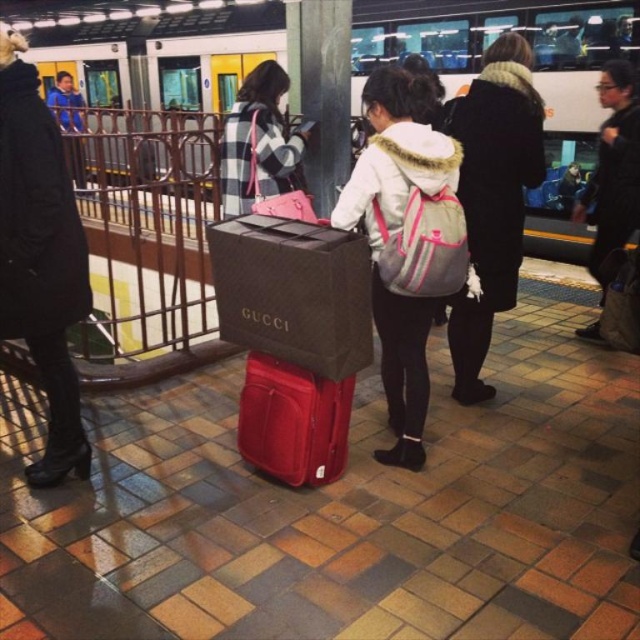
Question: Which object is the closest to the black leather jacket at upper right?

Choices:
 (A) smooth gray pillar at center
 (B) black wool coat at center
 (C) black leather coat at left
 (D) metallic silver train at center

Answer: (B)

Question: Is metallic silver train at center positioned at the back of black wool coat at center?

Choices:
 (A) no
 (B) yes

Answer: (B)

Question: Observing the image, what is the correct spatial positioning of matte black gucci bag at center in reference to white fleece jacket at center?

Choices:
 (A) left
 (B) right

Answer: (A)

Question: Is matte black gucci bag at center to the right of black wool coat at center from the viewer's perspective?

Choices:
 (A) yes
 (B) no

Answer: (B)

Question: Which of the following is the closest to the observer?

Choices:
 (A) metallic silver train at center
 (B) matte red suitcase at center

Answer: (B)

Question: Which object is closer to the camera taking this photo?

Choices:
 (A) matte red suitcase at center
 (B) matte black gucci bag at center
 (C) black wool coat at center
 (D) metallic silver train at center

Answer: (B)